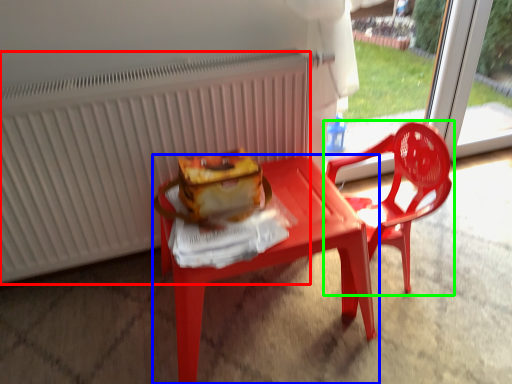
Question: Considering the real-world distances, which object is farthest from radiator (highlighted by a red box)? table (highlighted by a blue box) or chair (highlighted by a green box)?

Choices:
 (A) table
 (B) chair

Answer: (B)